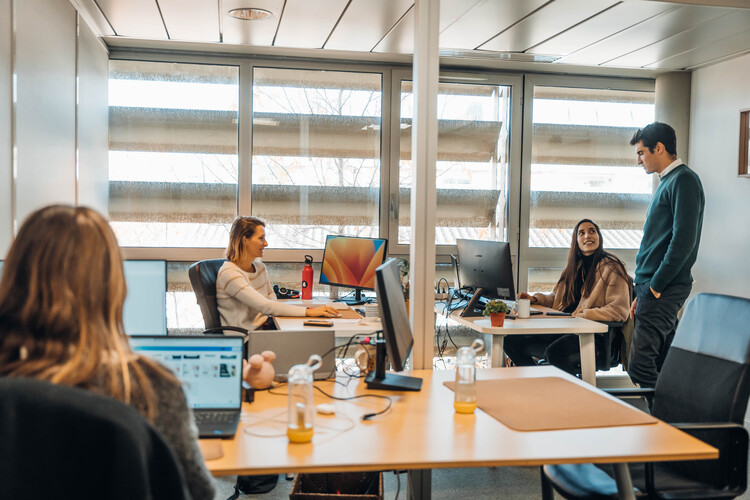
Where is `screens`? screens is located at coordinates (202, 382), (135, 289), (338, 261), (392, 314), (487, 268).